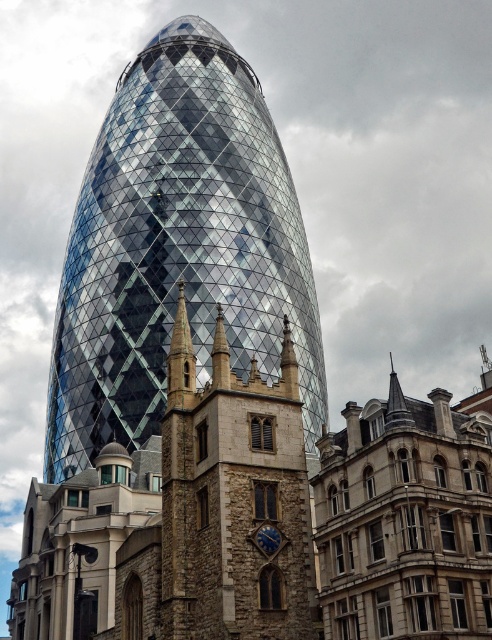
You are an architect comparing two central structures in an urban landscape. The geometric glass tower at center and the stone clock tower at center are both in your design plans. Based on their widths, which one would require more horizontal space in the city layout?

The geometric glass tower at center requires more horizontal space because its width surpasses that of the stone clock tower at center.

You are a tourist standing in the middle of the square between the geometric glass tower at center and the stone clock tower at center. You want to take a photo that includes both towers. Which direction should you face to ensure both are visible in the frame?

You should face to the right to include both the geometric glass tower at center and the stone clock tower at center in your photo, as the geometric glass tower at center is positioned to the left of the stone clock tower at center.